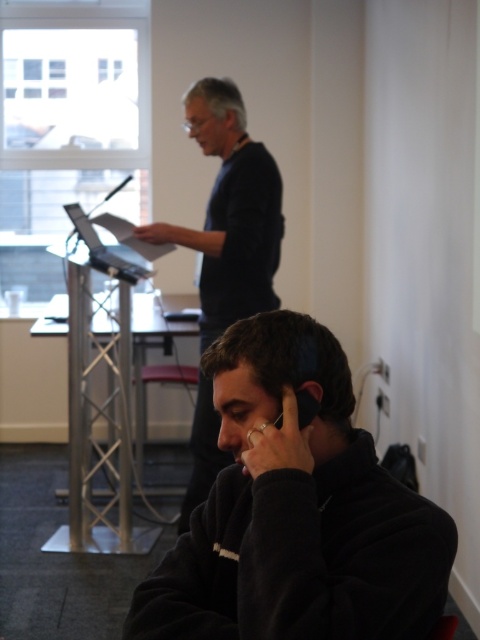
Question: Which of the following is the farthest from the observer?

Choices:
 (A) (224, 460)
 (B) (346, 564)

Answer: (A)

Question: Is black matte phone at lower center smaller than dark blue sweater at center?

Choices:
 (A) no
 (B) yes

Answer: (B)

Question: Is black matte phone at lower center above dark blue sweater at center?

Choices:
 (A) no
 (B) yes

Answer: (A)

Question: Which point is farther from the camera taking this photo?

Choices:
 (A) (362, 500)
 (B) (197, 424)

Answer: (B)

Question: Does black matte phone at lower center appear over dark blue sweater at center?

Choices:
 (A) no
 (B) yes

Answer: (A)

Question: Which point appears farthest from the camera in this image?

Choices:
 (A) (252, 506)
 (B) (200, 317)

Answer: (B)